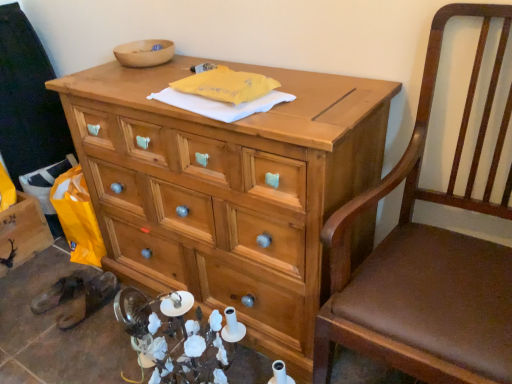
Question: From the image's perspective, is wooden bowl at upper center above or below natural wood desk at center?

Choices:
 (A) below
 (B) above

Answer: (B)

Question: Is wooden bowl at upper center wider or thinner than natural wood desk at center?

Choices:
 (A) thin
 (B) wide

Answer: (A)

Question: Considering the real-world distances, which object is farthest from the natural wood desk at center?

Choices:
 (A) wooden crate at lower left
 (B) wooden bowl at upper center
 (C) brown leather chair at right
 (D) brown leather sandals at lower left

Answer: (A)

Question: Which object is the farthest from the brown leather sandals at lower left?

Choices:
 (A) natural wood desk at center
 (B) brown leather chair at right
 (C) wooden crate at lower left
 (D) wooden bowl at upper center

Answer: (B)